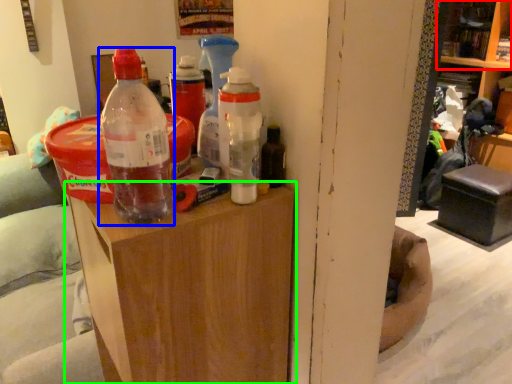
Question: Estimate the real-world distances between objects in this image. Which object is farther from shelf (highlighted by a red box), bottle (highlighted by a blue box) or furniture (highlighted by a green box)?

Choices:
 (A) bottle
 (B) furniture

Answer: (B)